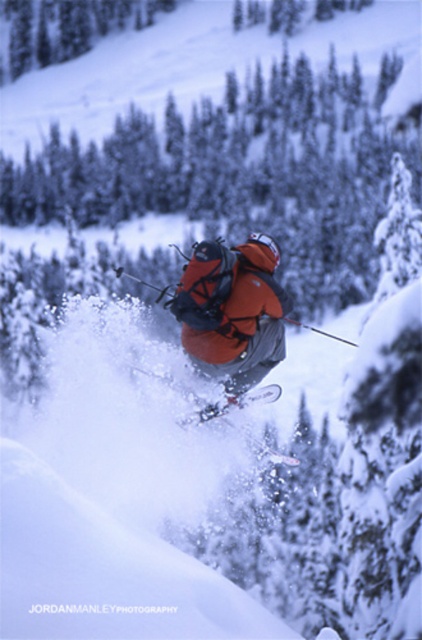
Question: Which object appears closest to the camera in this image?

Choices:
 (A) white matte skis at center
 (B) orange softshell jacket at center
 (C) white metallic ski at center

Answer: (B)

Question: Can you confirm if white metallic ski at center is thinner than white matte skis at center?

Choices:
 (A) no
 (B) yes

Answer: (A)

Question: Does white metallic ski at center appear on the right side of white matte skis at center?

Choices:
 (A) no
 (B) yes

Answer: (B)

Question: Can you confirm if orange softshell jacket at center is thinner than white metallic ski at center?

Choices:
 (A) no
 (B) yes

Answer: (B)

Question: Which of the following is the farthest from the observer?

Choices:
 (A) white matte skis at center
 (B) white metallic ski at center
 (C) orange softshell jacket at center

Answer: (B)

Question: Which is nearer to the white metallic ski at center?

Choices:
 (A) white matte skis at center
 (B) orange softshell jacket at center

Answer: (A)